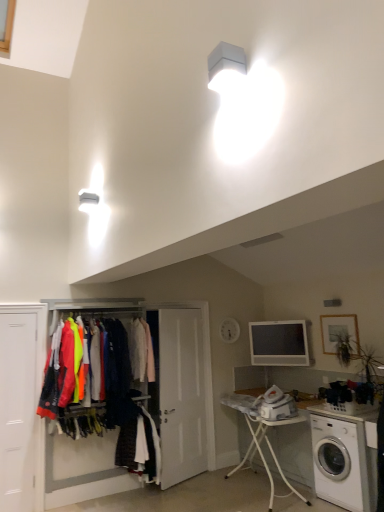
Question: Is neon fabric jackets at center, the second clothing when ordered from top to bottom, directly adjacent to white plastic ironing board at lower center?

Choices:
 (A) no
 (B) yes

Answer: (A)

Question: Does neon fabric jackets at center, the second clothing when ordered from top to bottom, have a greater height compared to white plastic ironing board at lower center?

Choices:
 (A) yes
 (B) no

Answer: (A)

Question: Would you say neon fabric jackets at center, which is the second clothing from bottom to top, is outside white plastic ironing board at lower center?

Choices:
 (A) no
 (B) yes

Answer: (B)

Question: Is the position of neon fabric jackets at center, the second clothing when ordered from top to bottom, more distant than that of white plastic ironing board at lower center?

Choices:
 (A) yes
 (B) no

Answer: (A)

Question: From the image's perspective, does neon fabric jackets at center, the second clothing when ordered from top to bottom, appear higher than white plastic ironing board at lower center?

Choices:
 (A) no
 (B) yes

Answer: (B)

Question: From the image's perspective, is white matte door at left positioned above or below matte gray monitor at center?

Choices:
 (A) below
 (B) above

Answer: (A)

Question: Considering the positions of point (11, 434) and point (301, 339), is point (11, 434) closer or farther from the camera than point (301, 339)?

Choices:
 (A) closer
 (B) farther

Answer: (A)

Question: Based on their positions, is white matte door at left located to the left or right of matte gray monitor at center?

Choices:
 (A) left
 (B) right

Answer: (A)

Question: Is white matte door at left inside or outside of matte gray monitor at center?

Choices:
 (A) inside
 (B) outside

Answer: (B)

Question: Is white fabric coat at center, the 3th clothing when ordered from bottom to top, in front of or behind matte gray monitor at center in the image?

Choices:
 (A) front
 (B) behind

Answer: (A)

Question: In terms of size, does white fabric coat at center, acting as the 1th clothing starting from the top, appear bigger or smaller than matte gray monitor at center?

Choices:
 (A) big
 (B) small

Answer: (A)

Question: Would you say white fabric coat at center, acting as the 1th clothing starting from the top, is inside or outside matte gray monitor at center?

Choices:
 (A) outside
 (B) inside

Answer: (A)

Question: Considering the positions of point (152, 358) and point (261, 333), is point (152, 358) closer or farther from the camera than point (261, 333)?

Choices:
 (A) closer
 (B) farther

Answer: (A)

Question: Considering the positions of matte gray monitor at center and white fabric coat at center, acting as the 1th clothing starting from the top, in the image, is matte gray monitor at center bigger or smaller than white fabric coat at center, acting as the 1th clothing starting from the top,?

Choices:
 (A) big
 (B) small

Answer: (B)

Question: From a real-world perspective, is matte gray monitor at center above or below white fabric coat at center, acting as the 1th clothing starting from the top?

Choices:
 (A) above
 (B) below

Answer: (B)